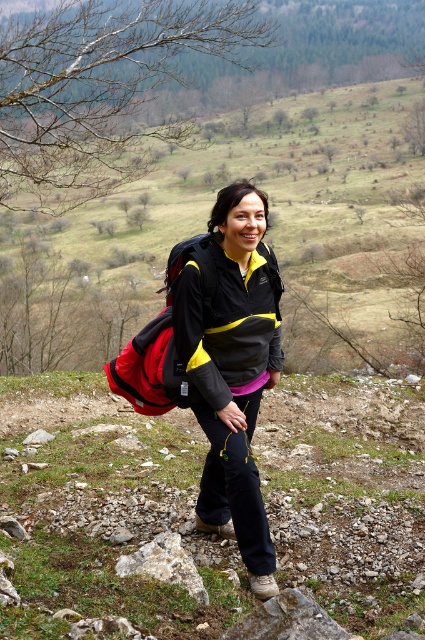
Question: Which point is closer to the camera?

Choices:
 (A) gray rough rock at lower center
 (B) black matte jacket at center

Answer: (B)

Question: Does black/yellow fabric jacket at center appear on the left side of gray rough rock at lower center?

Choices:
 (A) yes
 (B) no

Answer: (B)

Question: Which object is the closest to the gray rough rock at lower center?

Choices:
 (A) black/yellow fabric jacket at center
 (B) black matte jacket at center

Answer: (B)

Question: Among these objects, which one is farthest from the camera?

Choices:
 (A) gray rough rock at lower center
 (B) black/yellow fabric jacket at center
 (C) black matte jacket at center

Answer: (A)

Question: Is the position of black matte jacket at center more distant than that of black/yellow fabric jacket at center?

Choices:
 (A) yes
 (B) no

Answer: (A)

Question: Does black/yellow fabric jacket at center appear over gray rough rock at lower center?

Choices:
 (A) no
 (B) yes

Answer: (B)